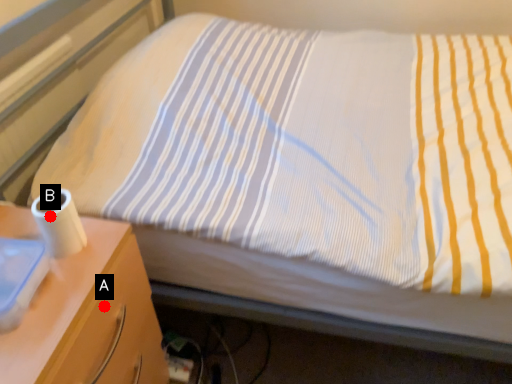
Question: Two points are circled on the image, labeled by A and B beside each circle. Which point appears closest to the camera in this image?

Choices:
 (A) A is closer
 (B) B is closer

Answer: (B)